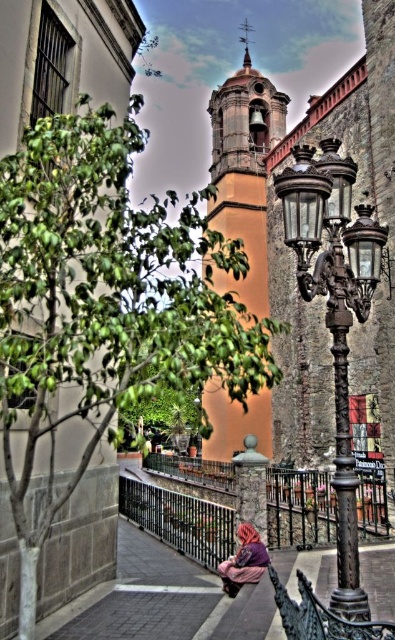
You are a photographer aiming to capture the purple fabric at lower center and the black wrought iron railing at center in your shot. Which object appears taller in the frame?

The black wrought iron railing at center appears taller than the purple fabric at lower center in the frame.

You are standing at the edge of the walkway and notice the orange stucco bell tower at center and the purple fabric at lower center. Which object is taller?

The orange stucco bell tower at center is taller than the purple fabric at lower center.

You are standing at the base of the green leafy tree at upper left and want to throw a ball to a friend who is exactly 69.23 feet away from you. If you throw the ball directly towards your friend, will it land where they are standing?

Yes, because the green leafy tree at upper left and the viewer are 69.23 feet apart, so if you throw the ball directly towards your friend who is exactly that distance away, it should land where they are standing.